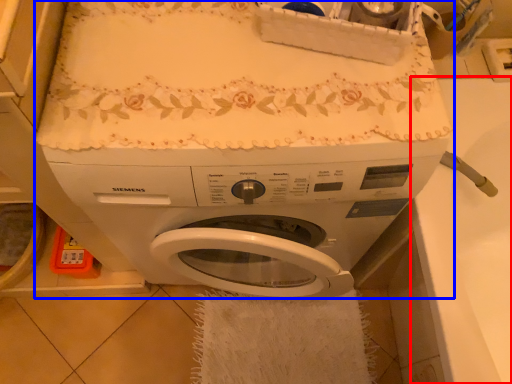
Question: Which object is closer to the camera taking this photo, counter top (highlighted by a red box) or washing machine (highlighted by a blue box)?

Choices:
 (A) counter top
 (B) washing machine

Answer: (B)